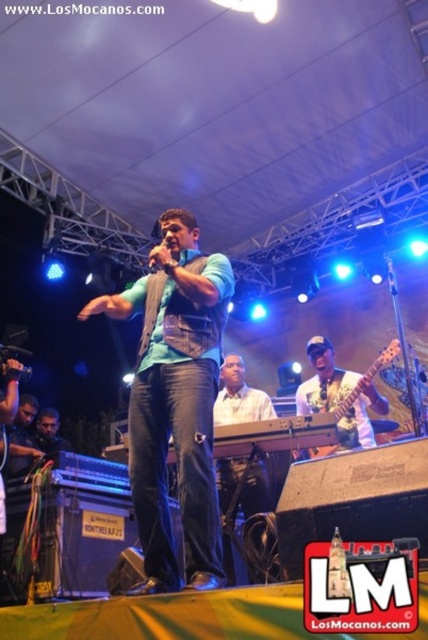
Who is taller, white matte guitar at center or black matte microphone at center?

With more height is white matte guitar at center.

Can you confirm if white matte guitar at center is bigger than black matte microphone at center?

Yes.

Does point (318, 401) lie behind point (157, 248)?

Yes, point (318, 401) is behind point (157, 248).

Where is `white matte guitar at center`? The height and width of the screenshot is (640, 428). white matte guitar at center is located at coordinates (342, 394).

How much distance is there between matte green vest at center and black matte microphone at center?

The distance of matte green vest at center from black matte microphone at center is 24.56 inches.

Between point (133, 417) and point (154, 250), which one is positioned behind?

Positioned behind is point (154, 250).

Is point (130, 438) positioned in front of point (169, 248)?

Yes.

At what (x,y) coordinates should I click in order to perform the action: click on matte green vest at center. Please return your answer as a coordinate pair (x, y). The width and height of the screenshot is (428, 640). Looking at the image, I should click on (175, 403).

Who is positioned more to the right, matte green vest at center or white matte guitar at center?

Positioned to the right is white matte guitar at center.

Is point (186, 573) farther from camera compared to point (315, 346)?

No, (186, 573) is closer to viewer.

Does point (139, 374) come farther from viewer compared to point (365, 433)?

No, it is not.

In order to click on matte green vest at center in this screenshot , I will do `click(175, 403)`.